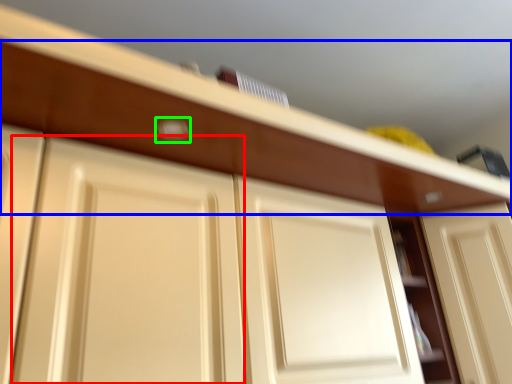
Question: Based on their relative distances, which object is farther from door (highlighted by a red box)? Choose from drawer (highlighted by a blue box) and door handle (highlighted by a green box).

Choices:
 (A) drawer
 (B) door handle

Answer: (B)